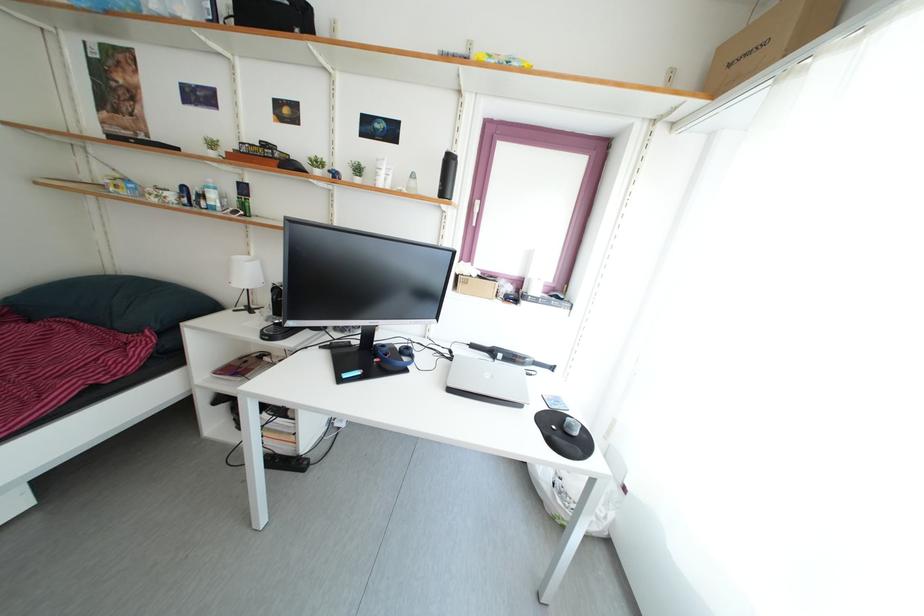
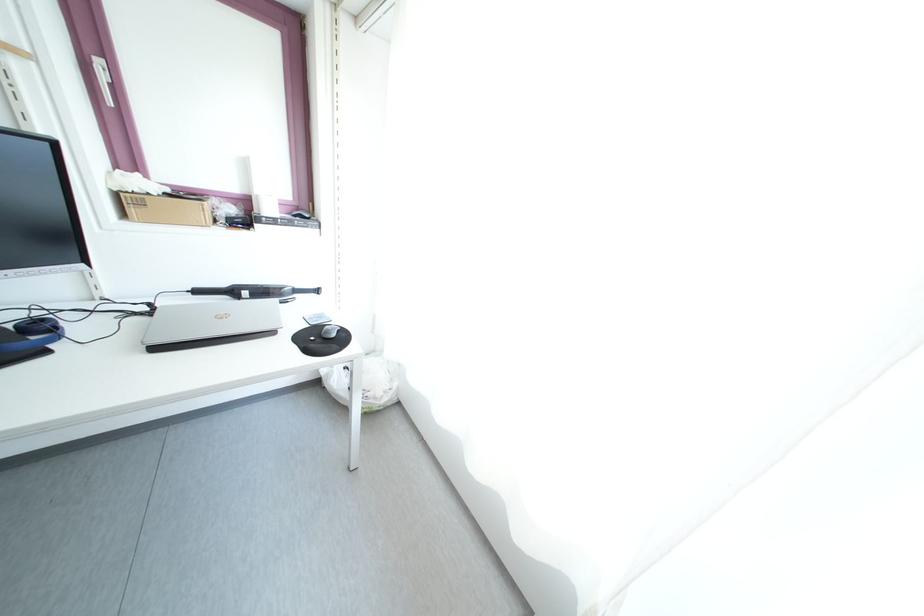
Locate, in the second image, the point that corresponds to [544,493] in the first image.

(344, 403)